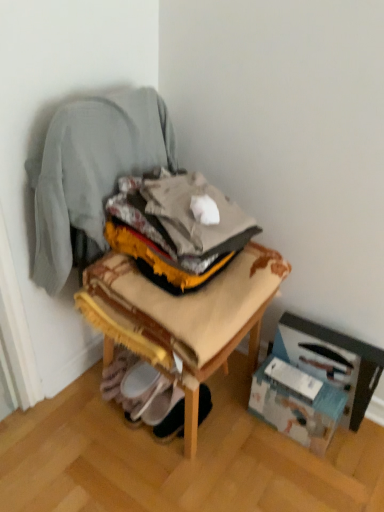
You are a GUI agent. You are given a task and a screenshot of the screen. Output one action in this format:
    pyautogui.click(x=<x>, y=<y>)
    Task: Click on the empty space that is in between wooden chair at center and teal cardboard box at lower right, positioned as the 1th cardboard box in left-to-right order
    
    Given the screenshot: What is the action you would take?
    pyautogui.click(x=260, y=453)